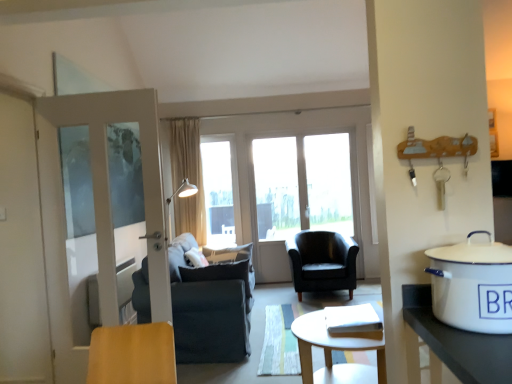
Question: Would you say dark gray fabric chair at center, placed as the second chair when sorted from right to left, is to the left or to the right of black leather armchair at center, the second chair in the left-to-right sequence, in the picture?

Choices:
 (A) right
 (B) left

Answer: (B)

Question: Is dark gray fabric chair at center, the 2th chair viewed from the back, wider or thinner than black leather armchair at center, the second chair in the left-to-right sequence?

Choices:
 (A) wide
 (B) thin

Answer: (A)

Question: Which is nearer to the transparent glass window at center?

Choices:
 (A) dark gray fabric chair at center, the 1th chair when ordered from front to back
 (B) beige fabric curtain at center
 (C) white enamel pot at right
 (D) white glossy screen door at left
 (E) black leather armchair at center, marked as the 1th chair in a back-to-front arrangement

Answer: (B)

Question: Which of these objects is positioned closest to the transparent glass window at center?

Choices:
 (A) dark gray fabric chair at center, placed as the second chair when sorted from right to left
 (B) white glossy screen door at left
 (C) black leather armchair at center, the second chair in the left-to-right sequence
 (D) light wood coffee table at center
 (E) white enamel pot at right

Answer: (C)